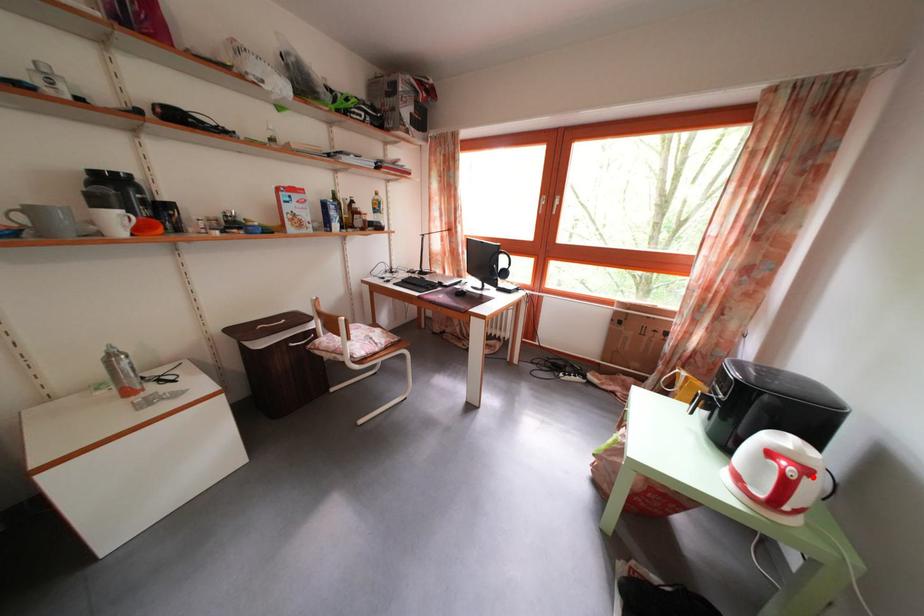
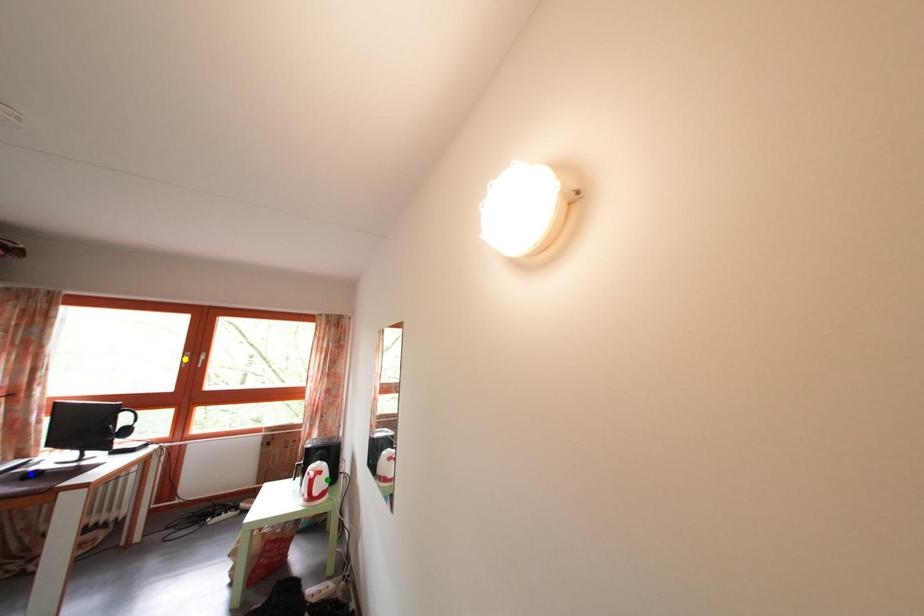
Question: I am providing you with two images of the same scene from different viewpoints. A red point is marked on the first image. You are given multiple points on the second image. Which spot in image 2 lines up with the point in image 1?

Choices:
 (A) blue point
 (B) yellow point
 (C) green point

Answer: (C)